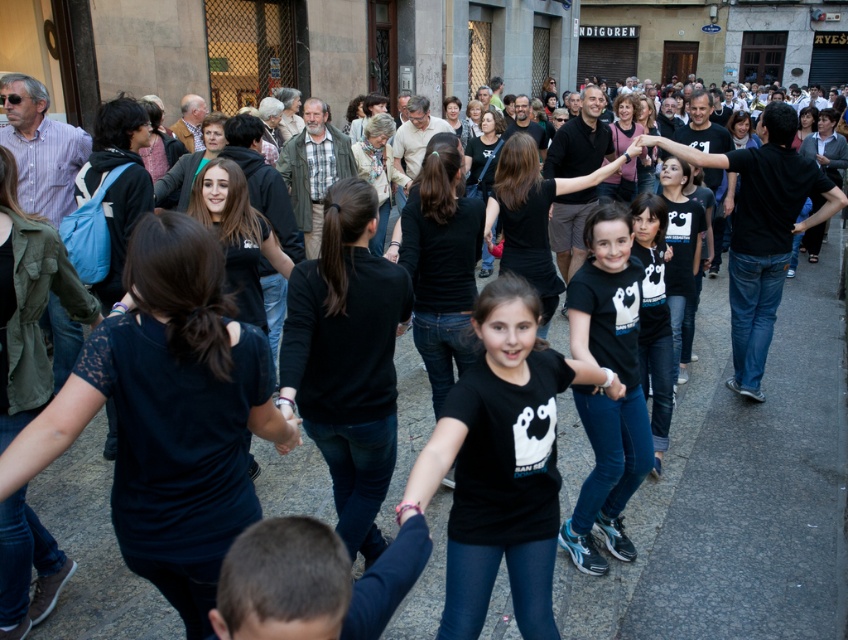
Is gray concrete pavement at center taller than black matte shirt at center?

No, gray concrete pavement at center is not taller than black matte shirt at center.

Which is above, gray concrete pavement at center or black matte shirt at center?

black matte shirt at center

Consider the image. Measure the distance between point (774, 332) and camera.

Point (774, 332) and camera are 7.32 meters apart.

I want to click on gray concrete pavement at center, so click(739, 490).